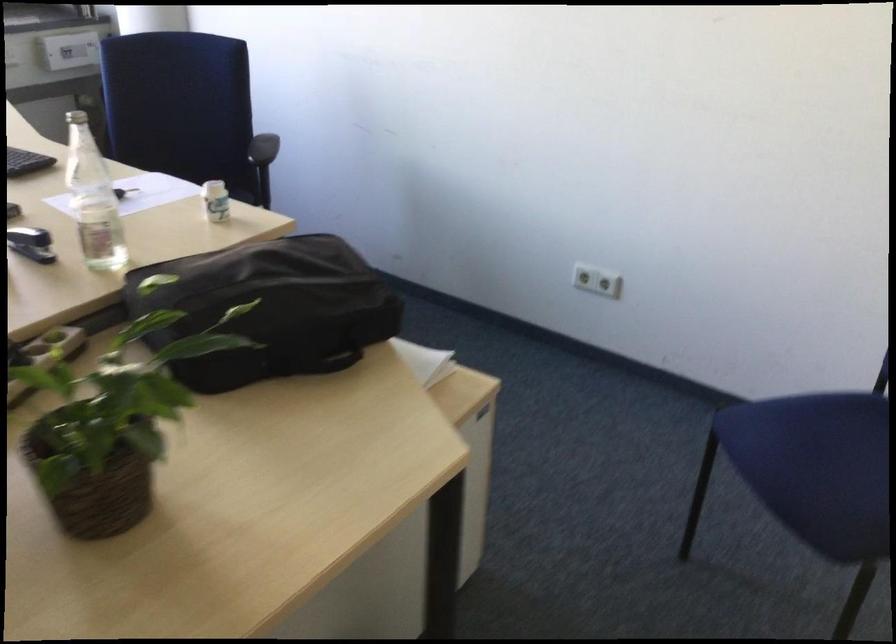
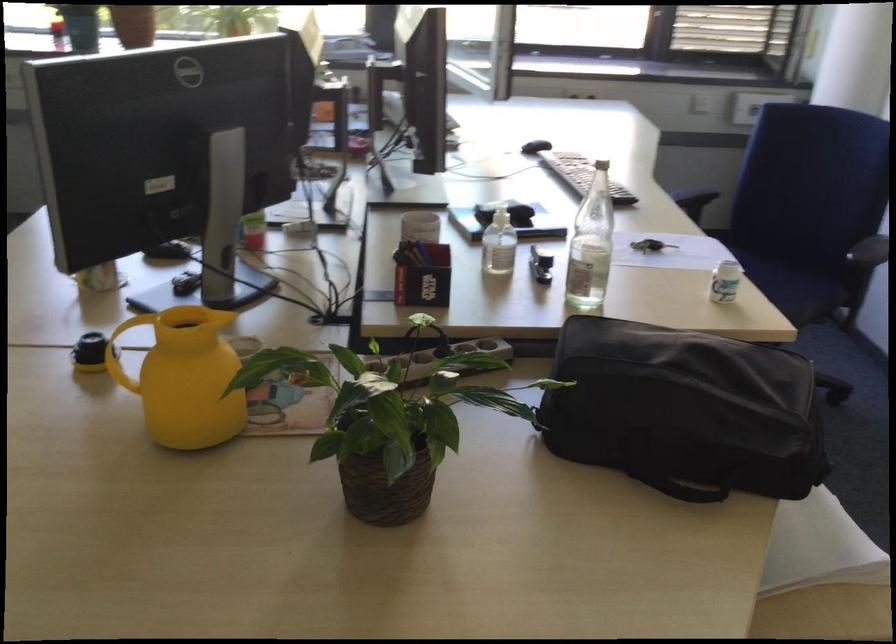
In the second image, find the point that corresponds to (x=126, y=204) in the first image.

(651, 245)